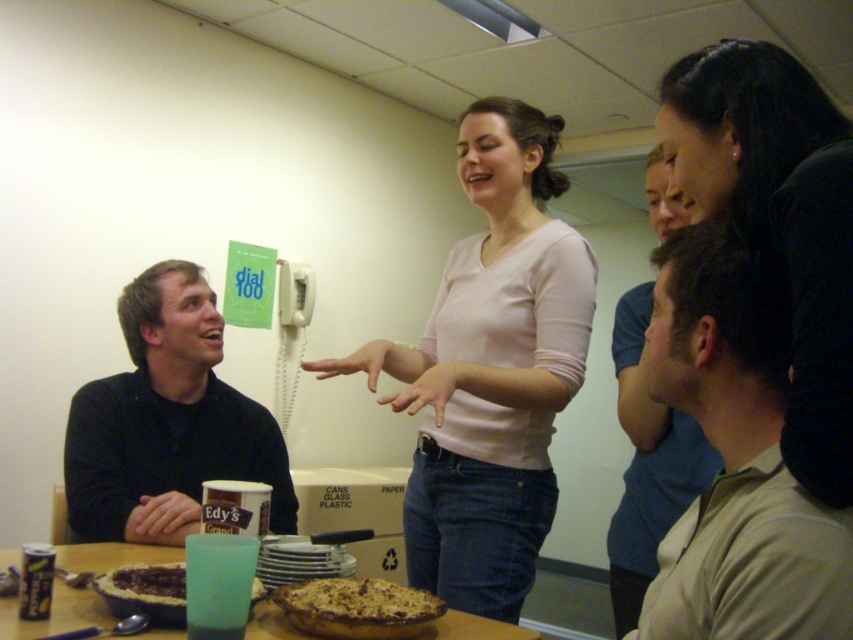
You are standing at the position of point (122, 554) and want to move to the door located at point (814, 600). Is the path clear for you to walk directly to the door without any obstacles?

Point (814, 600) is in front of point (122, 554), so the path is clear for you to walk directly to the door located at point (814, 600) without any obstacles.

You are a guest at the event and want to reach the Edy s Grand ice cream on the wooden table at center without touching the beige cotton shirt at center. Is this possible?

The beige cotton shirt at center is above the wooden table at center, so there is space below it where the Edy s Grand ice cream is located. You can reach the ice cream by moving around the shirt or under it if there is clearance.